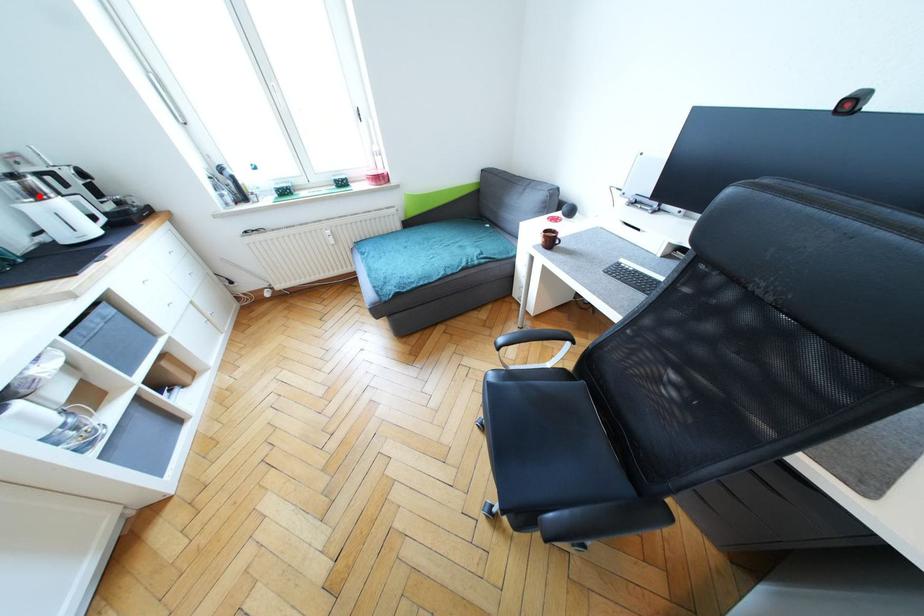
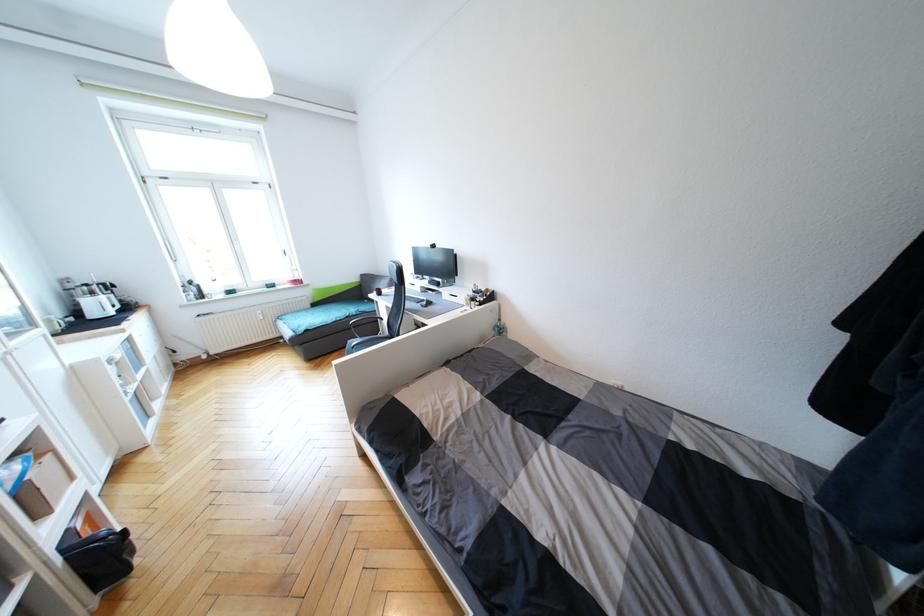
In the second image, find the point that corresponds to the highlighted location in the first image.

(95, 294)